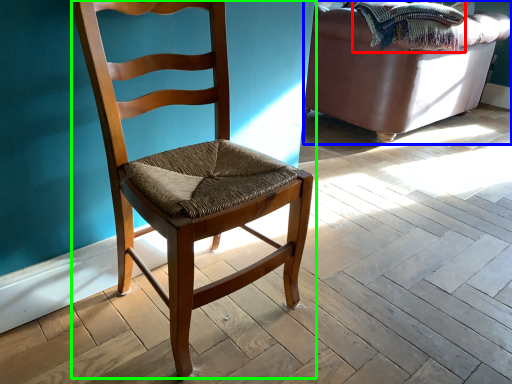
Question: Considering the real-world distances, which object is closest to blanket (highlighted by a red box)? studio couch (highlighted by a blue box) or chair (highlighted by a green box).

Choices:
 (A) studio couch
 (B) chair

Answer: (A)